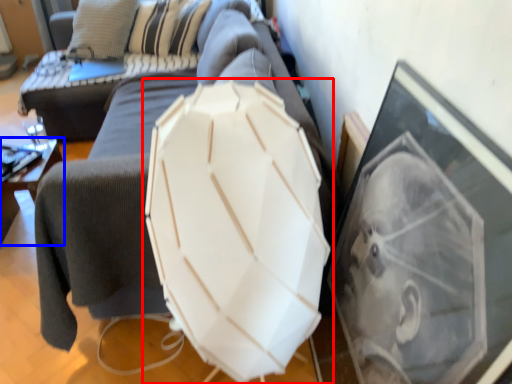
Question: Which object appears closest to the camera in this image, umbrella (highlighted by a red box) or furniture (highlighted by a blue box)?

Choices:
 (A) umbrella
 (B) furniture

Answer: (A)